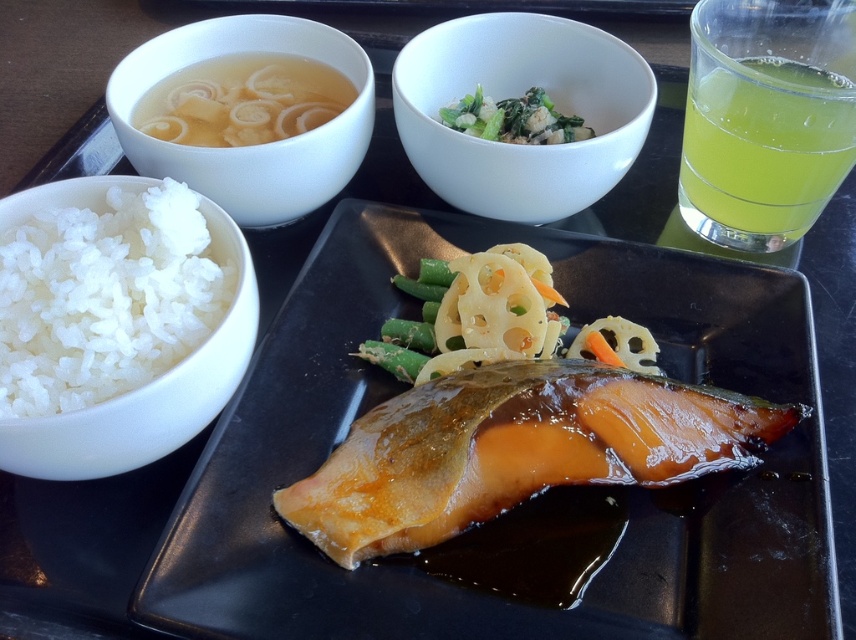
Question: Is glistening salmon at center thinner than green leafy vegetables at upper center?

Choices:
 (A) no
 (B) yes

Answer: (A)

Question: Is glossy ceramic platter at lower left thinner than glistening salmon at center?

Choices:
 (A) no
 (B) yes

Answer: (A)

Question: Estimate the real-world distances between objects in this image. Which object is closer to the translucent broth with noodles at upper left?

Choices:
 (A) translucent glass bowl at upper left
 (B) white matte rice bowl at left
 (C) translucent yellow liquid at upper right

Answer: (A)

Question: Which is nearer to the translucent yellow liquid at upper right?

Choices:
 (A) translucent glass bowl at upper left
 (B) translucent broth with noodles at upper left

Answer: (A)

Question: Observing the image, what is the correct spatial positioning of glossy ceramic platter at lower left in reference to green leafy vegetables at upper center?

Choices:
 (A) below
 (B) above

Answer: (A)

Question: Which object appears farthest from the camera in this image?

Choices:
 (A) translucent glass bowl at upper left
 (B) green leafy vegetables at upper center
 (C) translucent broth with noodles at upper left

Answer: (B)